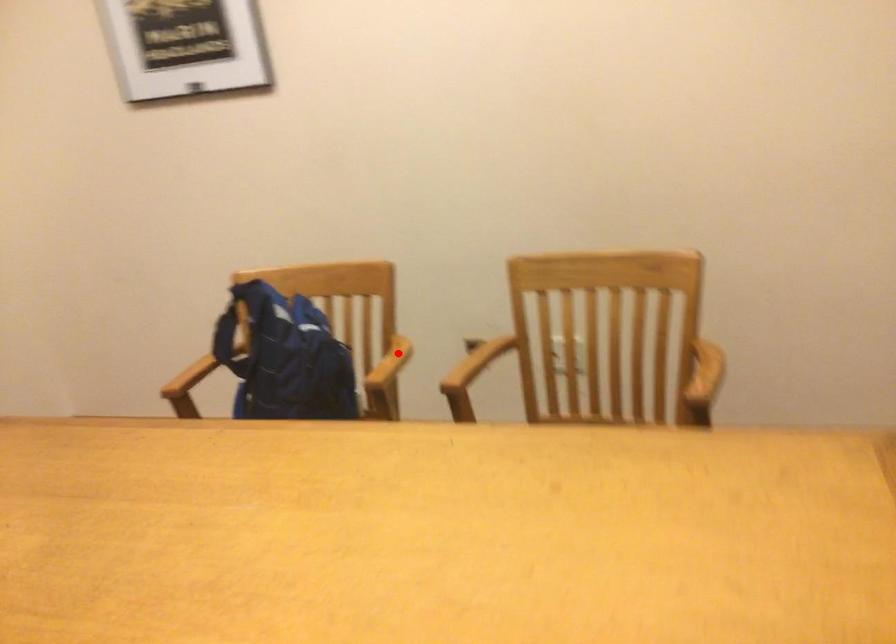
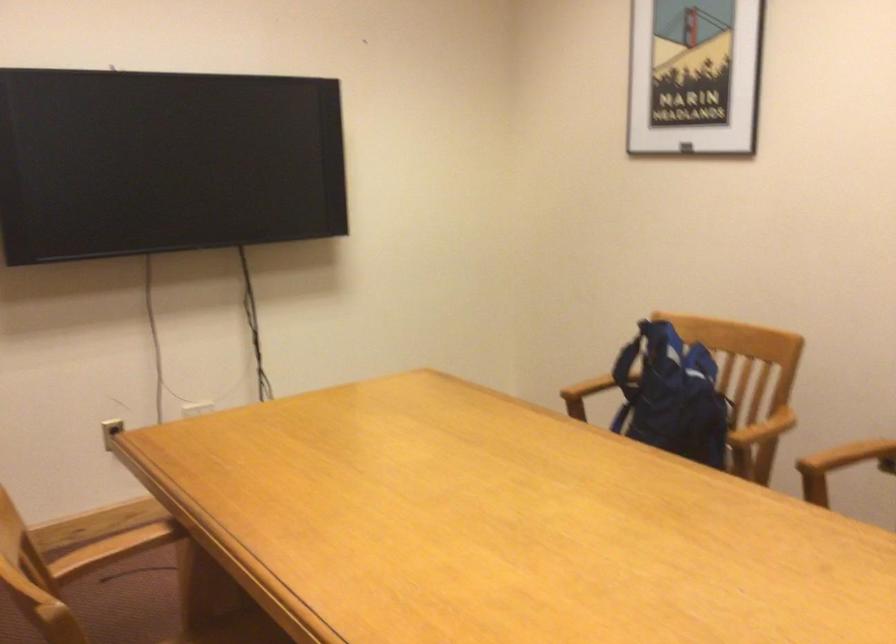
Where in the second image is the point corresponding to the highlighted location from the first image?

(763, 428)